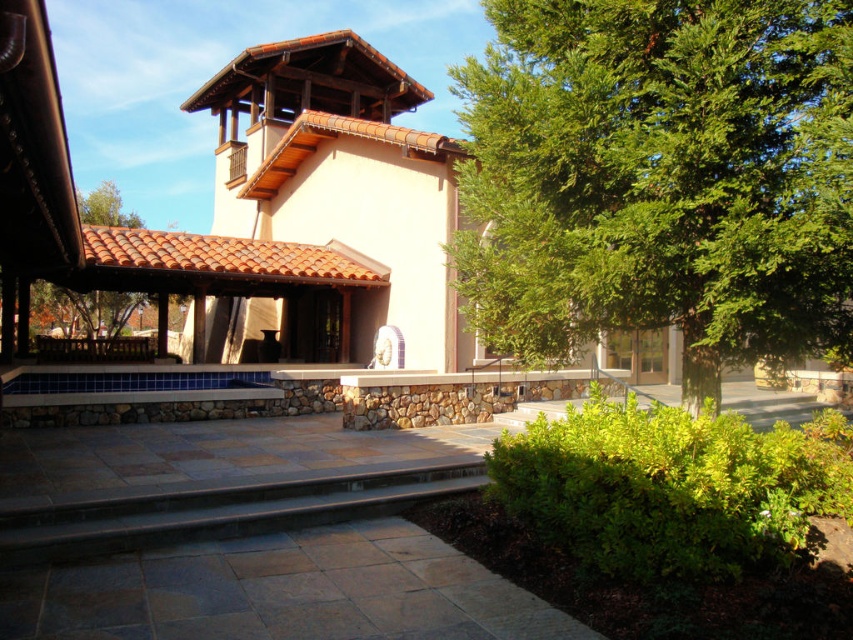
Is the position of terracotta tile gazebo at center more distant than that of dark gray stone stairs at lower center?

Yes.

Locate an element on the screen. terracotta tile gazebo at center is located at coordinates (341, 176).

This screenshot has height=640, width=853. What are the coordinates of `terracotta tile gazebo at center` in the screenshot? It's located at (341, 176).

Is point (822, 92) positioned in front of point (80, 548)?

That is True.

Measure the distance from green leafy tree at center to dark gray stone stairs at lower center.

14.74 feet

Find the location of a particular element. green leafy tree at center is located at coordinates (660, 177).

Can you confirm if green leafy tree at center is shorter than terracotta tile gazebo at center?

Indeed, green leafy tree at center has a lesser height compared to terracotta tile gazebo at center.

Between green leafy tree at center and terracotta tile gazebo at center, which one has less height?

Standing shorter between the two is green leafy tree at center.

Find the location of a particular element. This screenshot has width=853, height=640. green leafy tree at center is located at coordinates (660, 177).